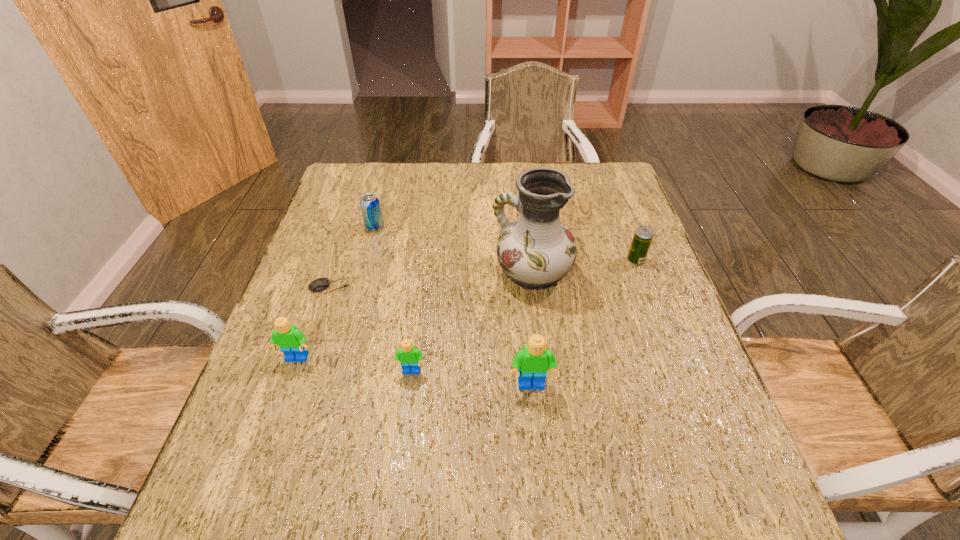
With all Legos evenly spaced, where should an extra Lego be placed on the right to continue the pattern? Please point out a vacant space. Please provide its 2D coordinates. Your answer should be formatted as a tuple, i.e. [(x, y)], where the tuple contains the x and y coordinates of a point satisfying the conditions above.

[(659, 400)]